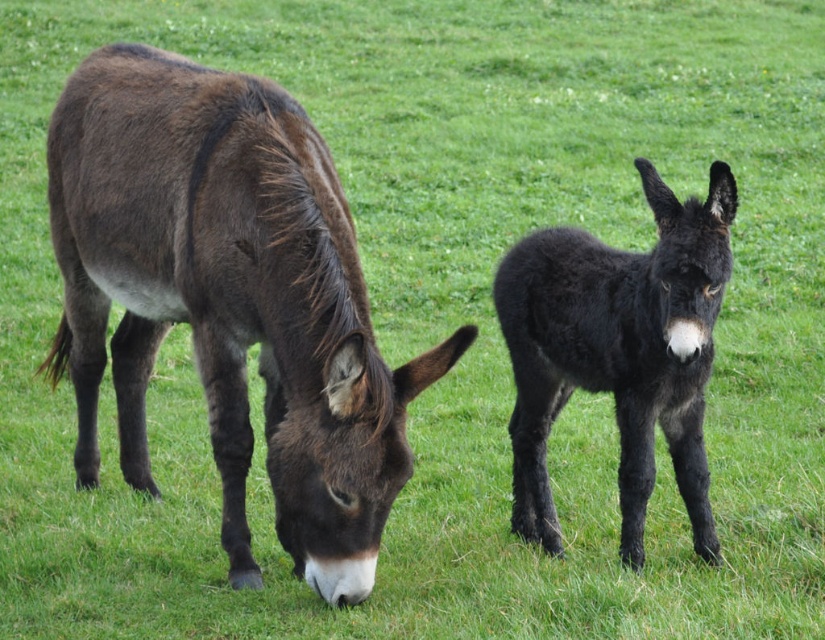
Who is more forward, (x=328, y=227) or (x=531, y=364)?

Positioned in front is point (x=328, y=227).

Identify the location of dark brown fur donkey at left. (229, 300).

Between point (92, 305) and point (512, 513), which one is positioned in front?

Positioned in front is point (512, 513).

This screenshot has height=640, width=825. I want to click on dark brown fur donkey at left, so click(x=229, y=300).